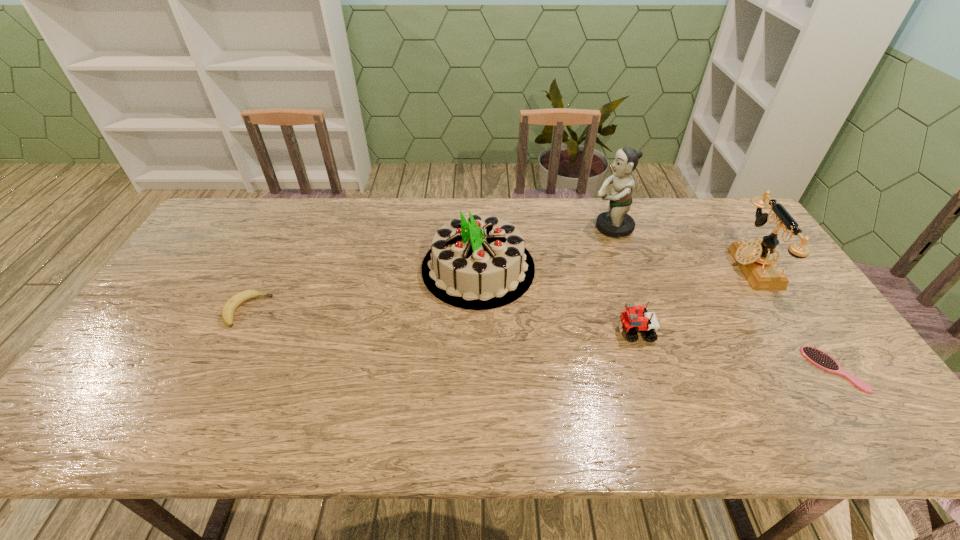
This screenshot has height=540, width=960. Find the location of `free spot between the fifth object from right to left and the tallest object`. free spot between the fifth object from right to left and the tallest object is located at coordinates tap(544, 248).

This screenshot has height=540, width=960. In order to click on unoccupied area between the telephone and the figurine in this screenshot , I will do `click(682, 247)`.

Find the location of a particular element. The width and height of the screenshot is (960, 540). vacant area between the figurine and the telephone is located at coordinates (682, 247).

Find the location of `free space that is in between the figurine and the telephone`. free space that is in between the figurine and the telephone is located at coordinates (682, 247).

Identify the location of empty space that is in between the tallest object and the shortest object. The width and height of the screenshot is (960, 540). (723, 299).

Where is `free spot between the nearest object and the tallest object`? The image size is (960, 540). free spot between the nearest object and the tallest object is located at coordinates (723, 299).

I want to click on free space between the second object from left to right and the Lego, so click(557, 300).

What are the coordinates of `object identified as the fifth closest to the fifth object from right to left` in the screenshot? It's located at (817, 357).

Locate which object is the fifth closest to the fifth object from right to left. Please provide its 2D coordinates. Your answer should be formatted as a tuple, i.e. [(x, y)], where the tuple contains the x and y coordinates of a point satisfying the conditions above.

[(817, 357)]

Where is `free space that satisfies the following two spatial constraints: 1. on the back side of the nearest object; 2. on the dial of the telephone`? The image size is (960, 540). free space that satisfies the following two spatial constraints: 1. on the back side of the nearest object; 2. on the dial of the telephone is located at coordinates (764, 267).